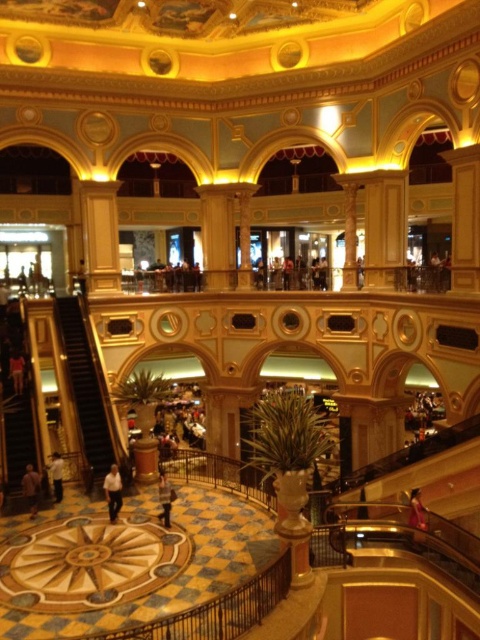
Between point (80, 336) and point (119, 497), which one is positioned behind?

Point (80, 336)

Describe the element at coordinates (86, 385) in the screenshot. I see `metallic gold escalator at left` at that location.

Which is behind, point (88, 401) or point (111, 472)?

Positioned behind is point (88, 401).

Identify the location of metallic gold escalator at left. (86, 385).

Which is more to the left, brown leather jacket at lower left or white matte shirt at lower left?

From the viewer's perspective, brown leather jacket at lower left appears more on the left side.

The height and width of the screenshot is (640, 480). What are the coordinates of `brown leather jacket at lower left` in the screenshot? It's located at (31, 488).

Who is more distant from viewer, (60, 336) or (56, 460)?

The point (60, 336) is more distant.

Does point (72, 371) come closer to viewer compared to point (60, 476)?

No, (72, 371) is further to viewer.

Is point (98, 442) behind point (55, 456)?

Yes, it is.

Locate an element on the screen. This screenshot has height=640, width=480. metallic gold escalator at left is located at coordinates (86, 385).